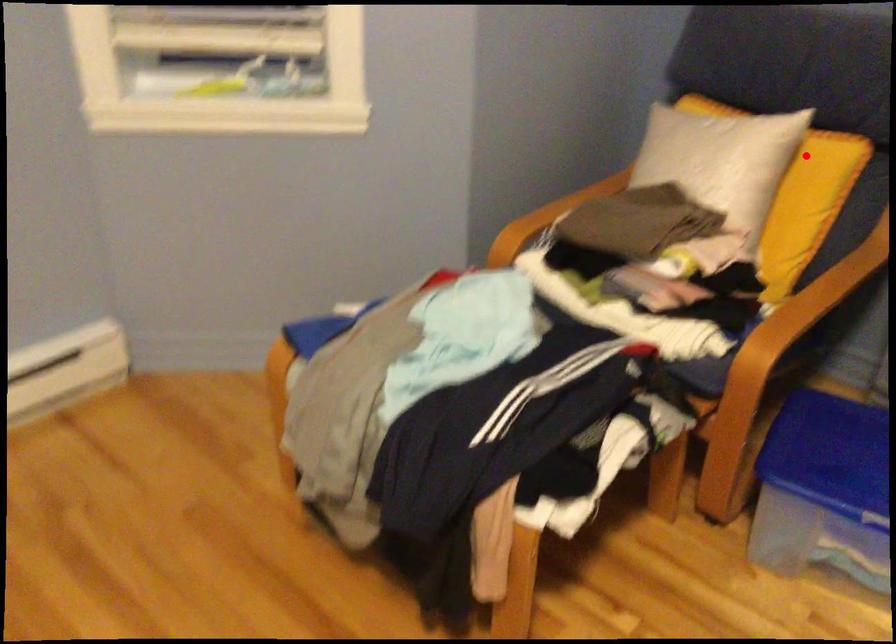
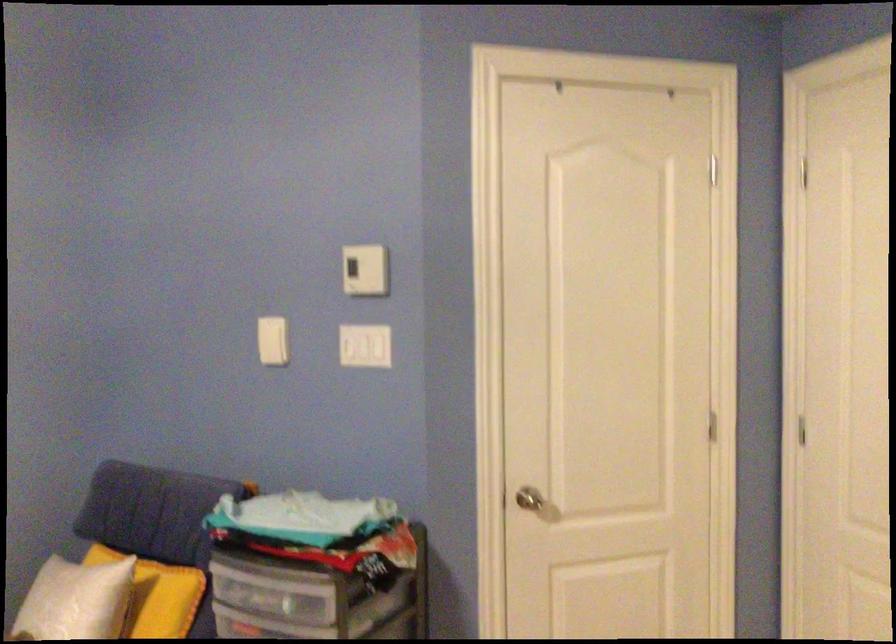
Where in the second image is the point corresponding to the highlighted location from the first image?

(157, 594)